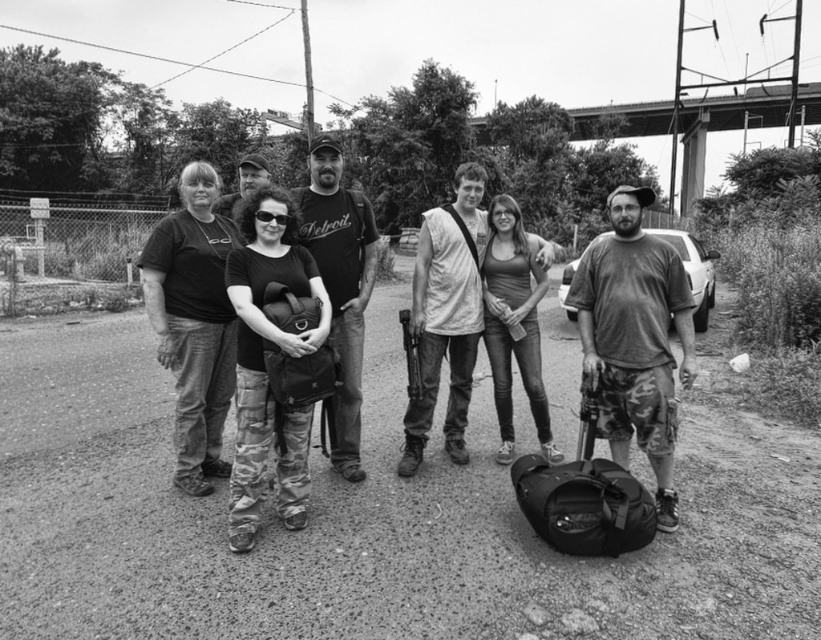
Question: Does dirt track at center have a greater width compared to matte black shirt at center?

Choices:
 (A) no
 (B) yes

Answer: (A)

Question: Which point is closer to the camera?

Choices:
 (A) dirty camouflage shorts at center
 (B) light gray cotton shirt at center
 (C) matte black t-shirt at center
 (D) camo pants at center

Answer: (D)

Question: Which is nearer to the matte black t-shirt at center?

Choices:
 (A) matte black shirt at center
 (B) camo pants at center
 (C) light gray cotton shirt at center
 (D) bearded man at center

Answer: (C)

Question: Where is dirty camouflage shorts at center located in relation to bearded man at center in the image?

Choices:
 (A) right
 (B) left

Answer: (A)

Question: Considering the real-world distances, which object is farthest from the matte black t-shirt at center?

Choices:
 (A) dirt track at center
 (B) camo pants at center
 (C) dirty camouflage shorts at center

Answer: (C)

Question: Does matte black shirt at center appear under bearded man at center?

Choices:
 (A) yes
 (B) no

Answer: (B)